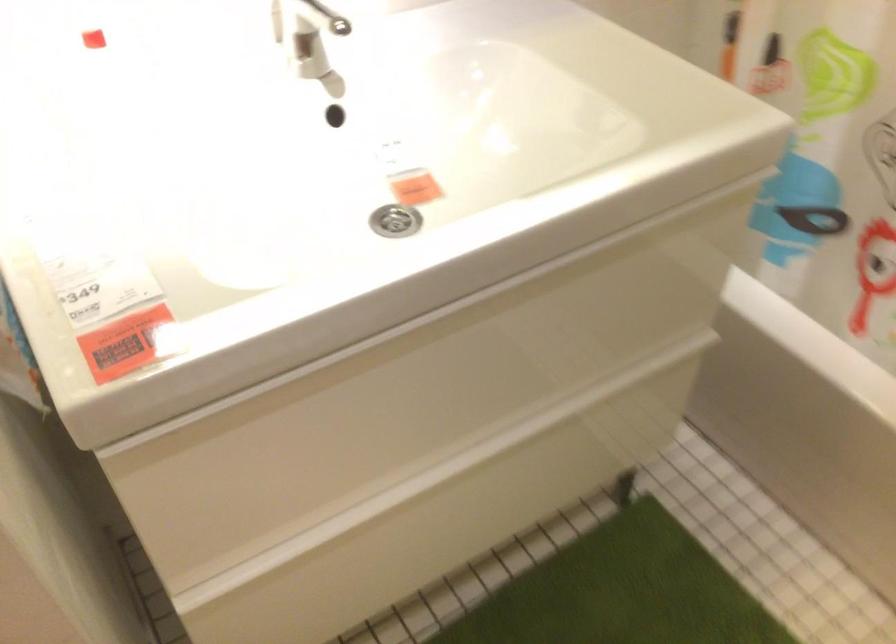
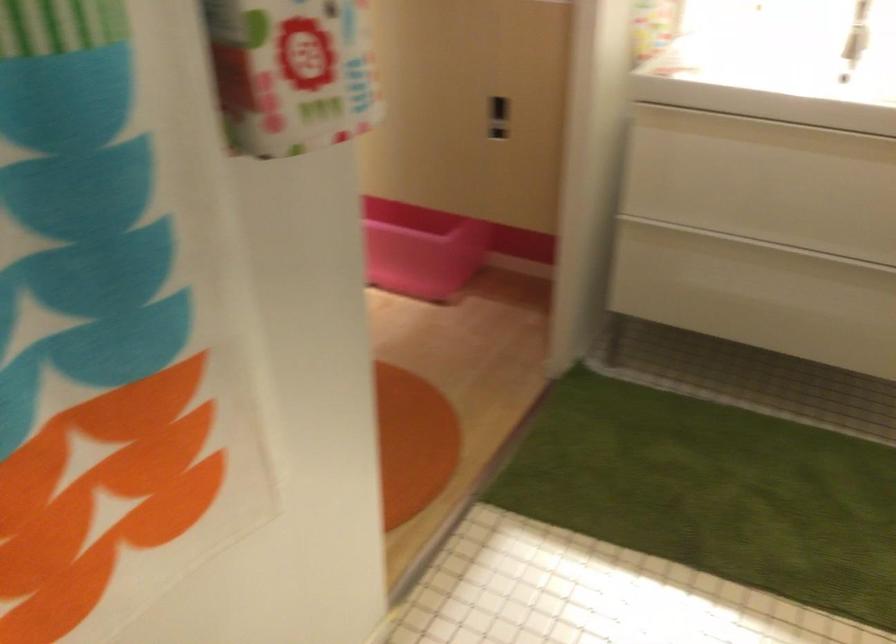
Where in the second image is the point corresponding to [386,354] from the first image?

(764, 131)